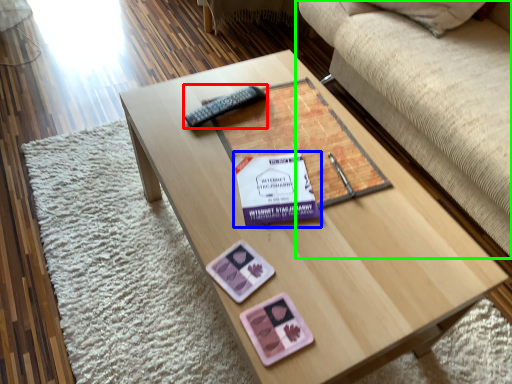
Question: Considering the real-world distances, which object is closest to remote (highlighted by a red box)? paperback book (highlighted by a blue box) or studio couch (highlighted by a green box).

Choices:
 (A) paperback book
 (B) studio couch

Answer: (A)